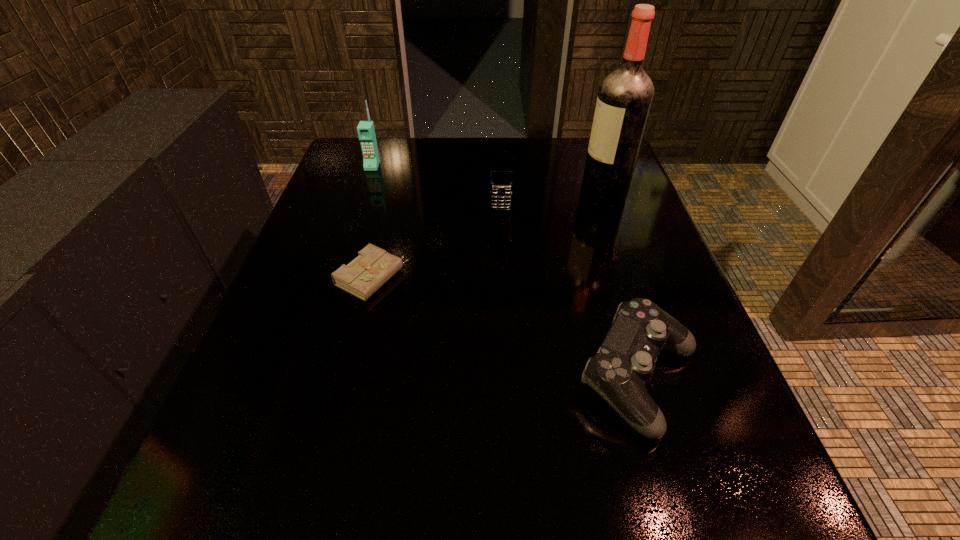
Identify the location of unoccupied position between the nearer cellular telephone and the tallest object. (552, 202).

Identify the location of vacant area between the fourth tallest object and the nearer cellular telephone. (569, 294).

Locate an element on the screen. vacant point located between the nearer cellular telephone and the diary is located at coordinates (436, 244).

The image size is (960, 540). I want to click on free space between the fourth farthest object and the nearer cellular telephone, so click(x=436, y=244).

Where is `free spot between the liquor and the third object from left to right`? This screenshot has height=540, width=960. free spot between the liquor and the third object from left to right is located at coordinates (552, 202).

Find the location of a particular element. This screenshot has height=540, width=960. vacant area that lies between the control and the farther cellular telephone is located at coordinates (506, 272).

Find the location of a particular element. Image resolution: width=960 pixels, height=540 pixels. unoccupied area between the tallest object and the nearest object is located at coordinates (621, 287).

Where is `empty space that is in between the farther cellular telephone and the tallest object`? Image resolution: width=960 pixels, height=540 pixels. empty space that is in between the farther cellular telephone and the tallest object is located at coordinates (488, 181).

The height and width of the screenshot is (540, 960). What are the coordinates of `object that is the closest to the farthest object` in the screenshot? It's located at pos(501,171).

Choose which object is the third nearest neighbor to the taller cellular telephone. Please provide its 2D coordinates. Your answer should be formatted as a tuple, i.e. [(x, y)], where the tuple contains the x and y coordinates of a point satisfying the conditions above.

[(624, 99)]